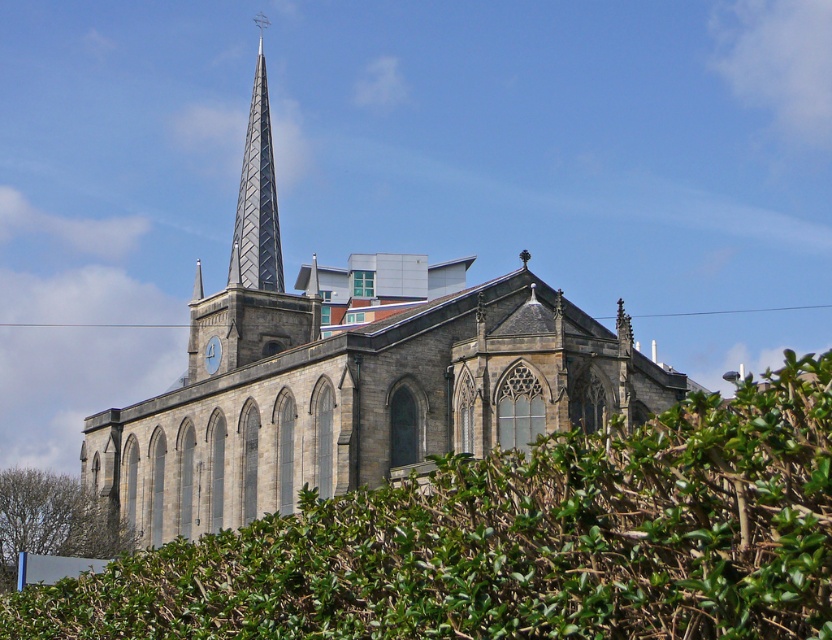
You are standing in front of the historic church and want to take a photo of the shiny metallic spire at upper center. However, the green leafy hedge at lower center is blocking your view. Can you move to a position where you can see the spire without the hedge obstructing it?

The green leafy hedge at lower center is closer to the viewer than the shiny metallic spire at upper center. Since the hedge is closer, moving backward or adjusting your angle might allow you to see the spire above or around the hedge.

You are standing in front of the historic church and want to take a photo of the shiny metallic spire at upper center without the green leafy hedge at lower center blocking it. Which direction should you move to ensure the spire is visible and the hedge is out of frame?

The green leafy hedge at lower center is to the right of the shiny metallic spire at upper center. To avoid the hedge blocking the view, you should move to the left side so that the spire remains centered while the hedge moves out of the frame to the right.